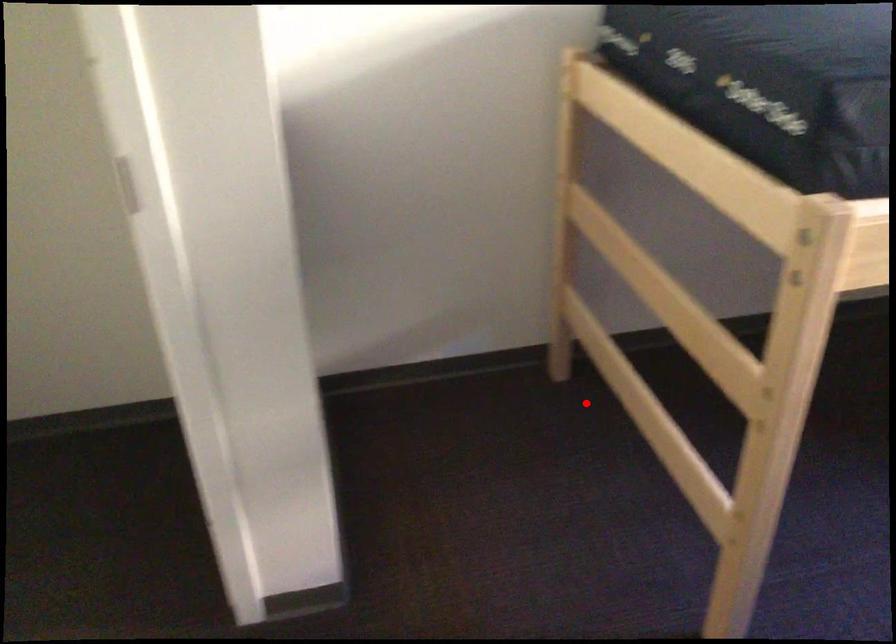
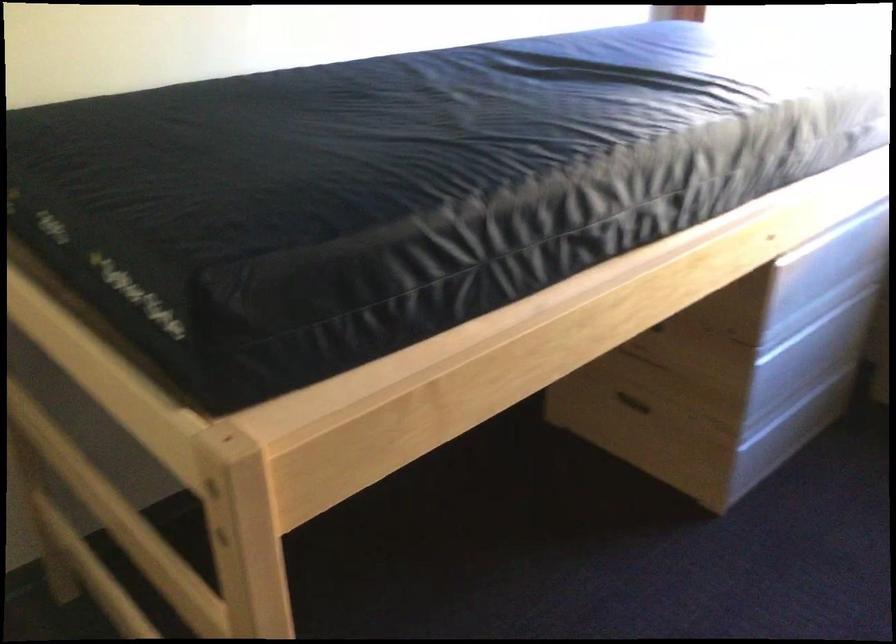
Question: I am providing you with two images of the same scene from different viewpoints. Image1 has a red point marked. In image2, the corresponding 3D location appears at what relative position? Reply with the corresponding letter.

Choices:
 (A) Closer
 (B) Farther

Answer: (A)